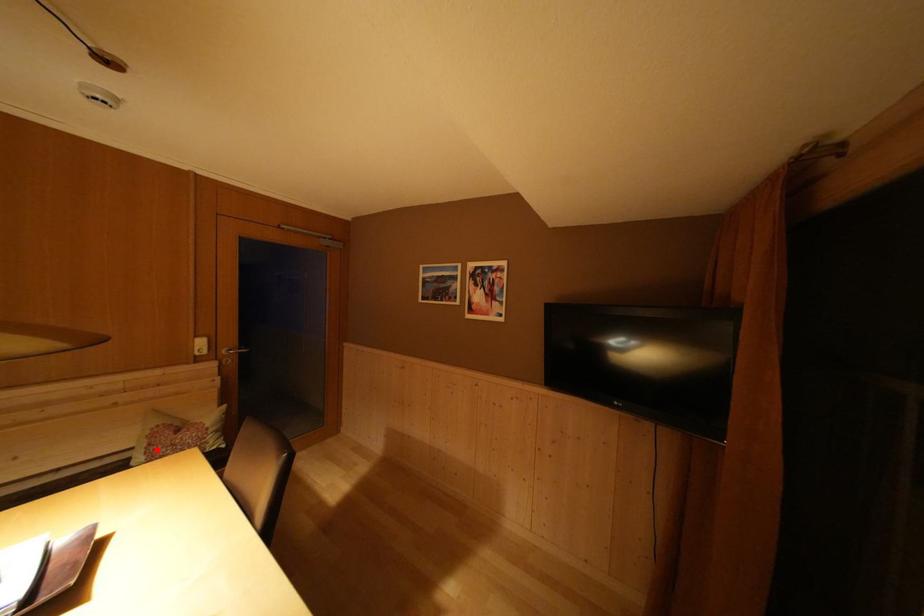
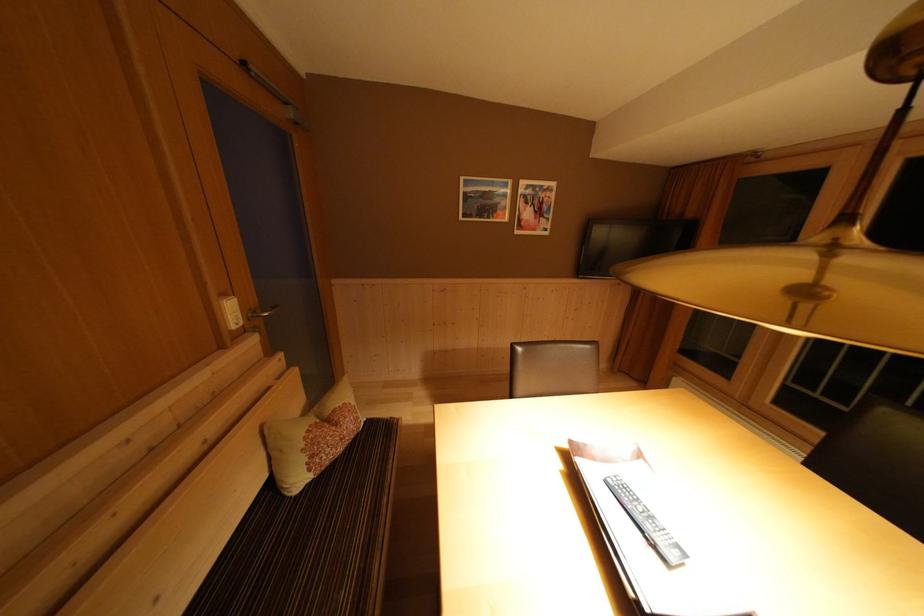
The point at the highlighted location is marked in the first image. Where is the corresponding point in the second image?

(319, 462)